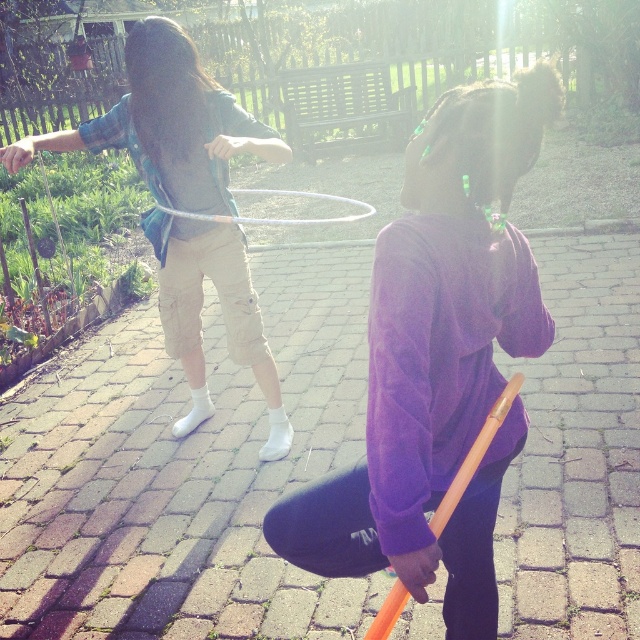
Who is positioned more to the right, matte green shirt at center or metallic silver hula hoop at center?

Positioned to the right is metallic silver hula hoop at center.

Who is more forward, (212, 83) or (268, 225)?

Point (212, 83)

This screenshot has height=640, width=640. Find the location of `matte green shirt at center`. matte green shirt at center is located at coordinates click(x=168, y=124).

Is purple fleece sweatshirt at center thinner than metallic silver hula hoop at center?

In fact, purple fleece sweatshirt at center might be wider than metallic silver hula hoop at center.

Does purple fleece sweatshirt at center have a larger size compared to metallic silver hula hoop at center?

Yes, purple fleece sweatshirt at center is bigger than metallic silver hula hoop at center.

Identify the location of purple fleece sweatshirt at center. This screenshot has height=640, width=640. point(436,360).

Where is `purple fleece sweatshirt at center`? purple fleece sweatshirt at center is located at coordinates (436, 360).

What are the coordinates of `purple fleece sweatshirt at center` in the screenshot? It's located at (436, 360).

Is purple fleece sweatshirt at center closer to camera compared to matte green shirt at center?

Yes, it is.

Where is `purple fleece sweatshirt at center`? purple fleece sweatshirt at center is located at coordinates (436, 360).